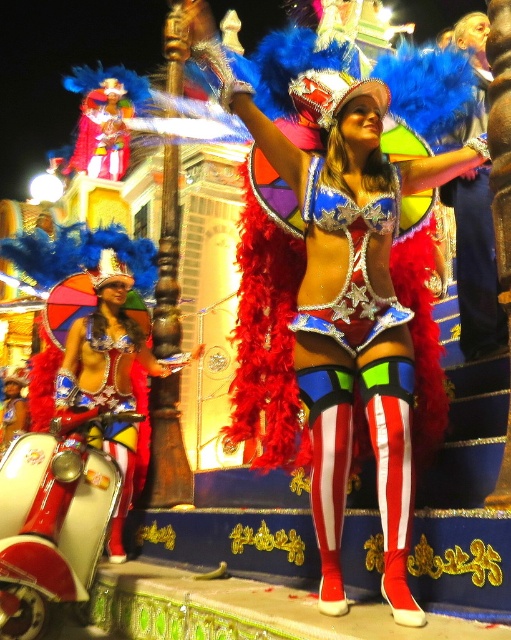
In the scene shown: Is shiny metallic costume at center positioned at the back of shiny metallic scooter at lower left?

No, shiny metallic costume at center is in front of shiny metallic scooter at lower left.

Does point (293, 413) lie behind point (103, 312)?

No, (293, 413) is closer to viewer.

At what (x,y) coordinates should I click in order to perform the action: click on shiny metallic costume at center. Please return your answer as a coordinate pair (x, y). Looking at the image, I should click on (340, 276).

Does white glossy scooter at lower left lie behind shiny metallic scooter at lower left?

That is False.

This screenshot has height=640, width=511. What are the coordinates of `white glossy scooter at lower left` in the screenshot? It's located at (53, 518).

Where is `white glossy scooter at lower left`? This screenshot has width=511, height=640. white glossy scooter at lower left is located at coordinates (53, 518).

Where is `white glossy scooter at lower left`? The height and width of the screenshot is (640, 511). white glossy scooter at lower left is located at coordinates (53, 518).

Does shiny metallic costume at center have a lesser width compared to white glossy scooter at lower left?

Incorrect, shiny metallic costume at center's width is not less than white glossy scooter at lower left's.

Which is in front, point (322, 461) or point (89, 516)?

Point (322, 461) is in front.

At what (x,y) coordinates should I click in order to perform the action: click on shiny metallic costume at center. Please return your answer as a coordinate pair (x, y). Image resolution: width=511 pixels, height=640 pixels. Looking at the image, I should click on (340, 276).